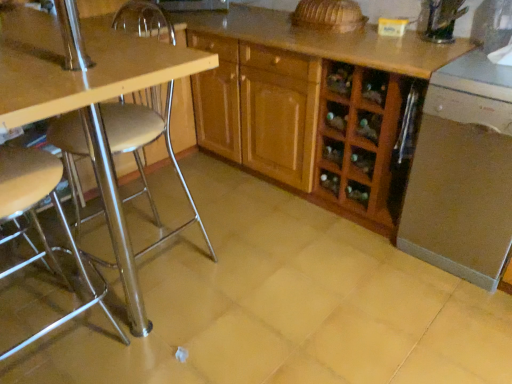
Find the location of a particular element. vacant area that lies between wooden table at left and metallic silver stool at left is located at coordinates (160, 300).